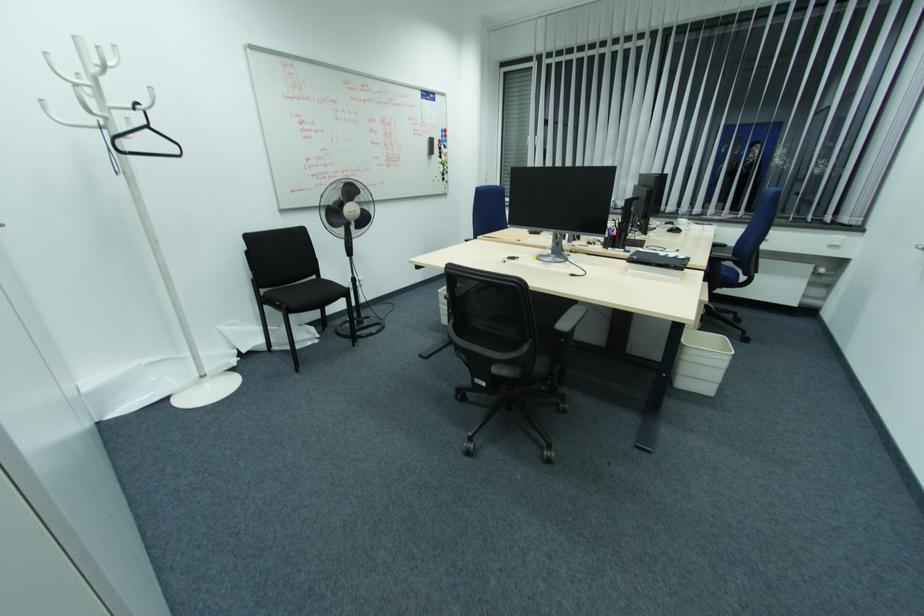
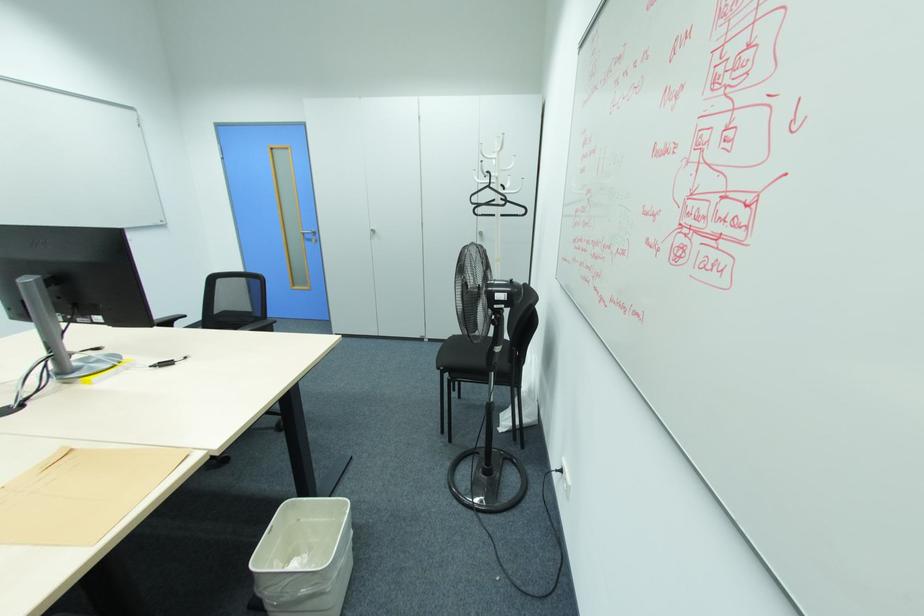
Locate, in the second image, the point that corresponds to point 149,128 in the first image.

(490, 187)